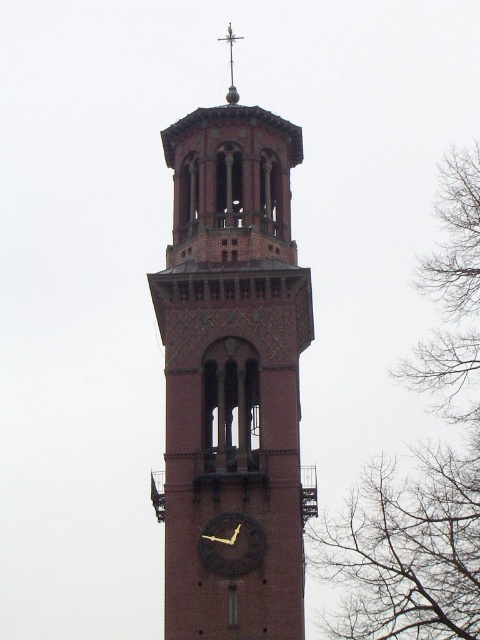
In the scene shown: Does brick clock tower at center have a greater height compared to bare branches at right?

No.

Between point (186, 448) and point (457, 234), which one is positioned in front?

Point (186, 448)

Where is `brick clock tower at center`? brick clock tower at center is located at coordinates [232, 371].

Can you confirm if brick clock tower at center is bigger than polished brass weather vane at upper center?

Indeed, brick clock tower at center has a larger size compared to polished brass weather vane at upper center.

Does brick clock tower at center have a greater height compared to polished brass weather vane at upper center?

Yes.

Which is behind, point (203, 177) or point (232, 61)?

The point (232, 61) is behind.

I want to click on brick clock tower at center, so click(x=232, y=371).

Locate an element on the screen. brick clock tower at center is located at coordinates (232, 371).

Between brick clock tower at center and black matte clock at center, which one has more height?

brick clock tower at center

The height and width of the screenshot is (640, 480). Find the location of `brick clock tower at center`. brick clock tower at center is located at coordinates (232, 371).